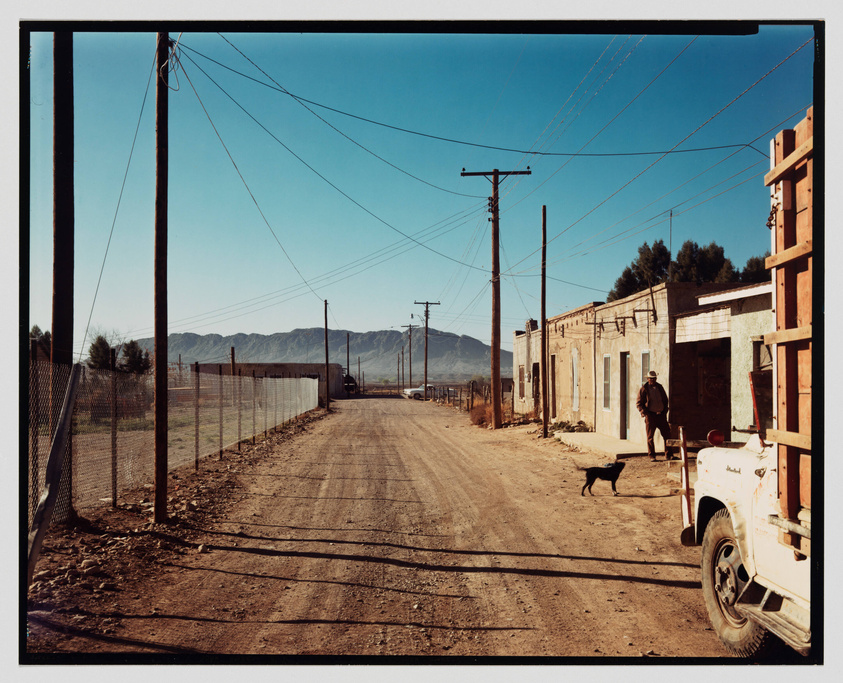
Image resolution: width=843 pixels, height=683 pixels. In order to click on cable in this screenshot , I will do click(707, 169).